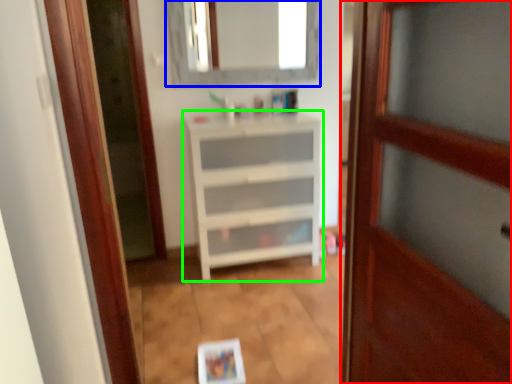
Question: Considering the real-world distances, which object is farthest from door (highlighted by a red box)? mirror (highlighted by a blue box) or chest of drawers (highlighted by a green box)?

Choices:
 (A) mirror
 (B) chest of drawers

Answer: (A)